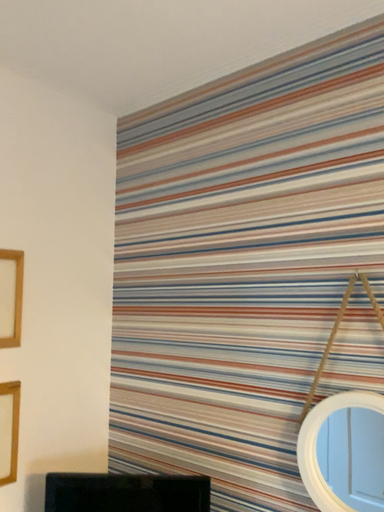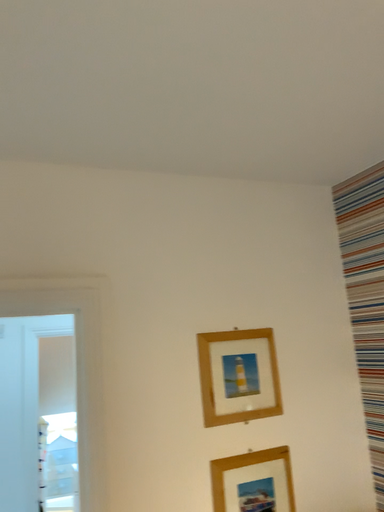
Question: How did the camera likely rotate when shooting the video?

Choices:
 (A) rotated right
 (B) rotated left

Answer: (B)